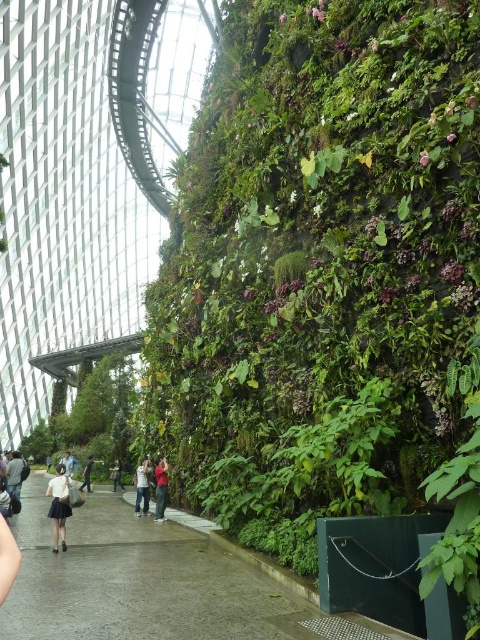
Consider the image. You are a visitor in the indoor garden and want to take a photo of the matte red shirt at center without the green leafy wall at center blocking the view. Is this possible?

The green leafy wall at center is positioned over matte red shirt at center, so taking a photo of the matte red shirt at center without the green leafy wall at center blocking the view is not possible because the wall is directly in front of the shirt.

You are a visitor in this indoor garden and want to take a photo of both the green leafy wall at center and the matte red shirt at center. Which object should you focus on first to ensure both are in sharp focus?

You should focus on the green leafy wall at center first because it is closer to the viewer than the matte red shirt at center, so adjusting focus from near to far will help both be in sharp focus.